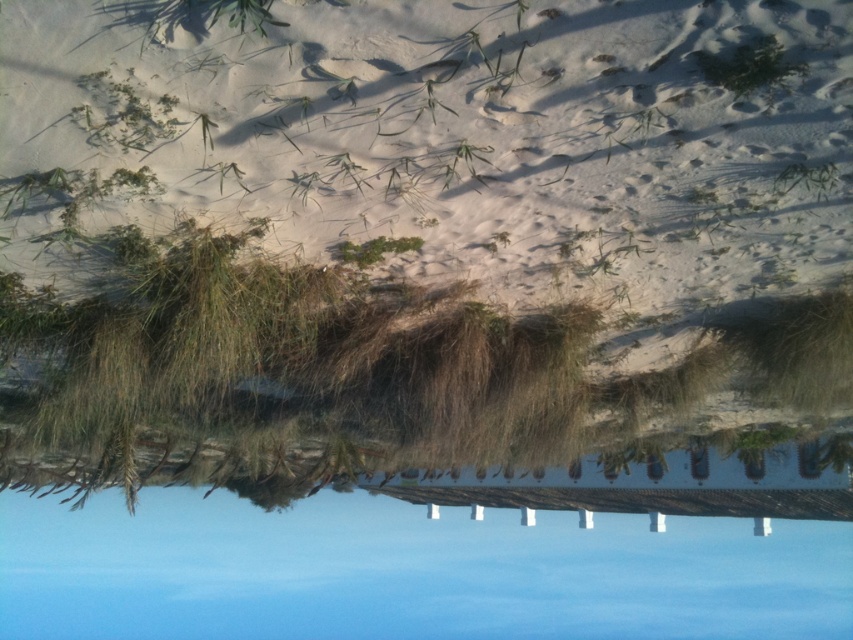
You are planning to build a small cabin in the snowy area. Given that the white fluffy snow at center and blue glass lake at center are both present, which area would be more suitable for the cabin foundation based on their spatial coverage?

The blue glass lake at center occupies more space than the white fluffy snow at center, so the area with the blue glass lake at center would be more suitable for the cabin foundation due to its larger coverage.

You are standing at the edge of the scene and want to walk towards the center. Which object, the white fluffy snow at center or the blue glass lake at center, will you encounter first based on their heights?

The white fluffy snow at center has a lesser height compared to the blue glass lake at center, so you will encounter the white fluffy snow at center first as it is lower in height.